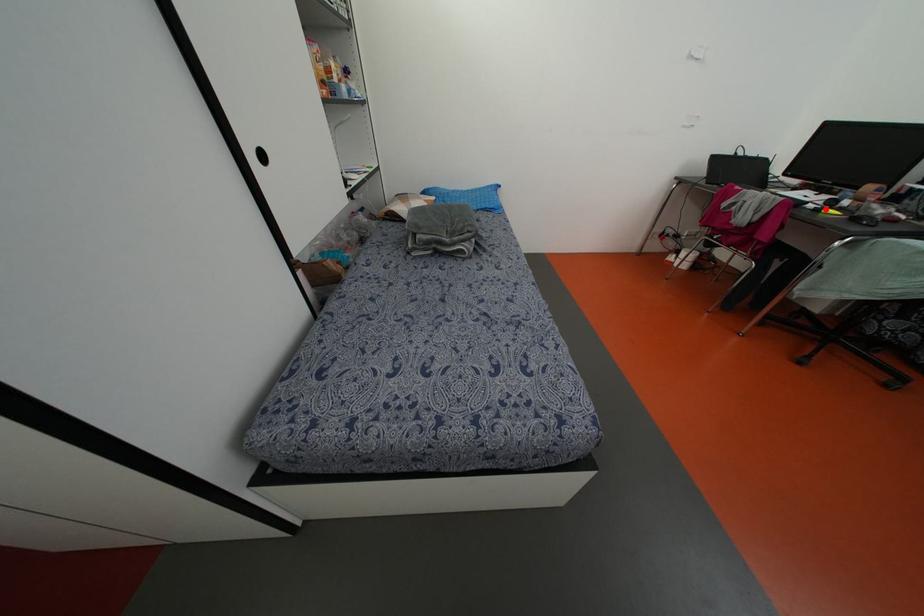
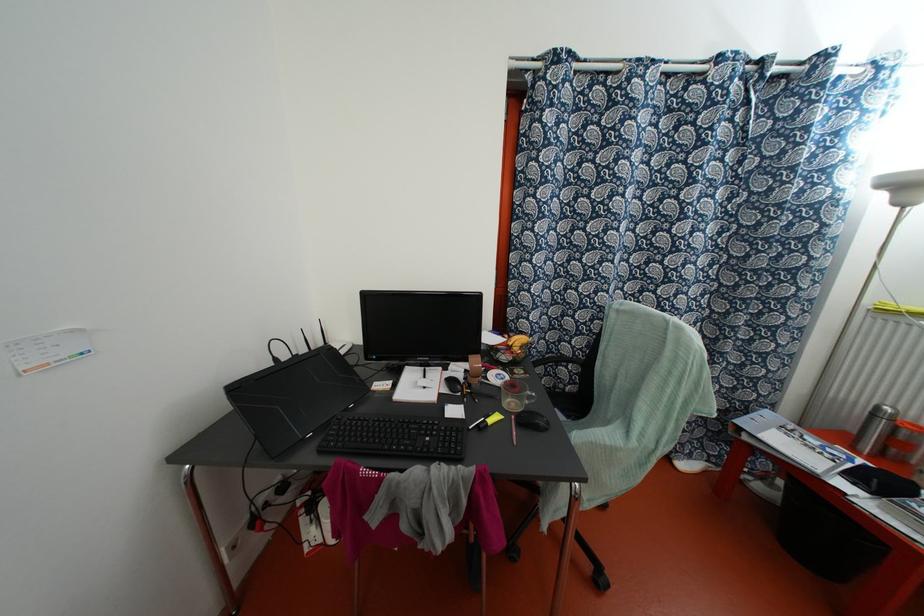
Question: I am providing you with two images of the same scene from different viewpoints. A red point is shown in image1. For the corresponding object point in image2, is it positioned nearer or farther from the camera?

Choices:
 (A) Nearer
 (B) Farther

Answer: (A)